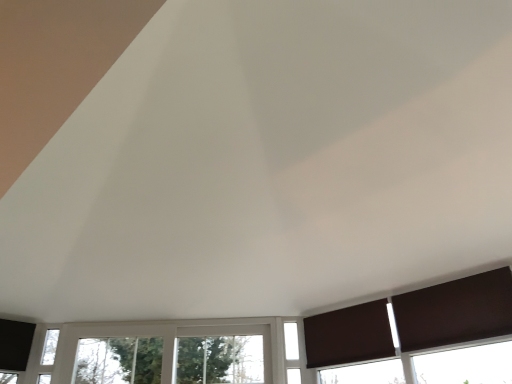
Question: From the image's perspective, would you say brown matte curtain at lower right, the 2th curtain in the left-to-right sequence, is shown under white glass window at center, the 2th window from the left?

Choices:
 (A) yes
 (B) no

Answer: (B)

Question: Does brown matte curtain at lower right, the 2th curtain in the left-to-right sequence, have a greater width compared to white glass window at center, which appears as the first window when viewed from the right?

Choices:
 (A) yes
 (B) no

Answer: (A)

Question: Is brown matte curtain at lower right, placed as the second curtain when sorted from back to front, taller than white glass window at center, the 2th window from the left?

Choices:
 (A) no
 (B) yes

Answer: (A)

Question: From a real-world perspective, is brown matte curtain at lower right, placed as the second curtain when sorted from back to front, positioned under white glass window at center, which appears as the first window when viewed from the right, based on gravity?

Choices:
 (A) yes
 (B) no

Answer: (B)

Question: Is brown matte curtain at lower right, the 2th curtain in the left-to-right sequence, surrounding white glass window at center, the 2th window from the left?

Choices:
 (A) no
 (B) yes

Answer: (A)

Question: Considering the relative sizes of brown matte curtain at lower right, placed as the second curtain when sorted from back to front, and white glass window at center, the 2th window from the left, in the image provided, is brown matte curtain at lower right, placed as the second curtain when sorted from back to front, smaller than white glass window at center, the 2th window from the left,?

Choices:
 (A) no
 (B) yes

Answer: (A)

Question: Is brown matte curtain at lower right, arranged as the first curtain when viewed from the left, smaller than white plastic window at center, placed as the first window when sorted from left to right?

Choices:
 (A) yes
 (B) no

Answer: (A)

Question: Is brown matte curtain at lower right, the 2th curtain from the right, at the left side of white plastic window at center, placed as the first window when sorted from left to right?

Choices:
 (A) yes
 (B) no

Answer: (B)

Question: Does brown matte curtain at lower right, arranged as the first curtain when viewed from the left, have a lesser width compared to white plastic window at center, placed as the first window when sorted from left to right?

Choices:
 (A) yes
 (B) no

Answer: (A)

Question: Can you confirm if brown matte curtain at lower right, which is the 2th curtain from front to back, is shorter than white plastic window at center, placed as the first window when sorted from left to right?

Choices:
 (A) yes
 (B) no

Answer: (A)

Question: From the image's perspective, is brown matte curtain at lower right, which is the 2th curtain from front to back, under white plastic window at center, marked as the second window in a right-to-left arrangement?

Choices:
 (A) no
 (B) yes

Answer: (A)

Question: Does brown matte curtain at lower right, which is the 2th curtain from front to back, have a larger size compared to white plastic window at center, placed as the first window when sorted from left to right?

Choices:
 (A) yes
 (B) no

Answer: (B)

Question: Is white glass window at center, the 2th window from the left, behind brown matte curtain at lower right, placed as the second curtain when sorted from back to front?

Choices:
 (A) no
 (B) yes

Answer: (B)